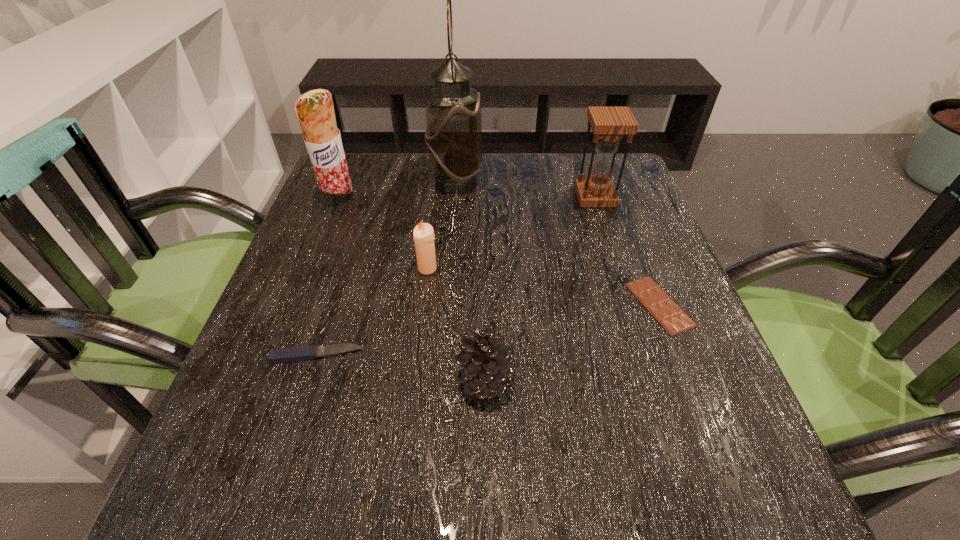
The width and height of the screenshot is (960, 540). I want to click on hourglass that is at the right edge, so click(x=609, y=124).

The height and width of the screenshot is (540, 960). What are the coordinates of `chocolate bar present at the right edge` in the screenshot? It's located at (670, 316).

At what (x,y) coordinates should I click in order to perform the action: click on object present at the far left corner. Please return your answer as a coordinate pair (x, y). Looking at the image, I should click on (315, 111).

Locate an element on the screen. Image resolution: width=960 pixels, height=540 pixels. object at the far right corner is located at coordinates (609, 124).

At what (x,y) coordinates should I click in order to perform the action: click on vacant space at the far edge of the desktop. Please return your answer as a coordinate pair (x, y). The image size is (960, 540). Looking at the image, I should click on (522, 178).

The width and height of the screenshot is (960, 540). I want to click on vacant point at the near edge, so click(408, 480).

In the image, there is a desktop. Where is `vacant area at the left edge`? vacant area at the left edge is located at coordinates (274, 313).

In the image, there is a desktop. At what (x,y) coordinates should I click in order to perform the action: click on free space at the right edge. Please return your answer as a coordinate pair (x, y). This screenshot has height=540, width=960. Looking at the image, I should click on (655, 255).

Where is `free location at the far left corner of the desktop`? free location at the far left corner of the desktop is located at coordinates (353, 157).

You are a GUI agent. You are given a task and a screenshot of the screen. Output one action in this format:
    pyautogui.click(x=<x>, y=<y>)
    Task: Click on the free spot between the steak knife and the candle
    
    Given the screenshot: What is the action you would take?
    pyautogui.click(x=372, y=312)